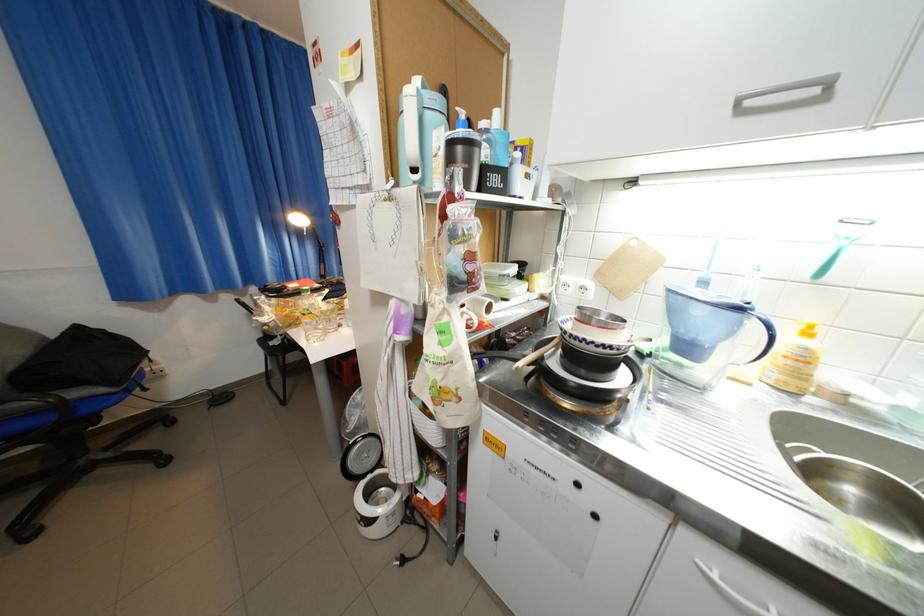
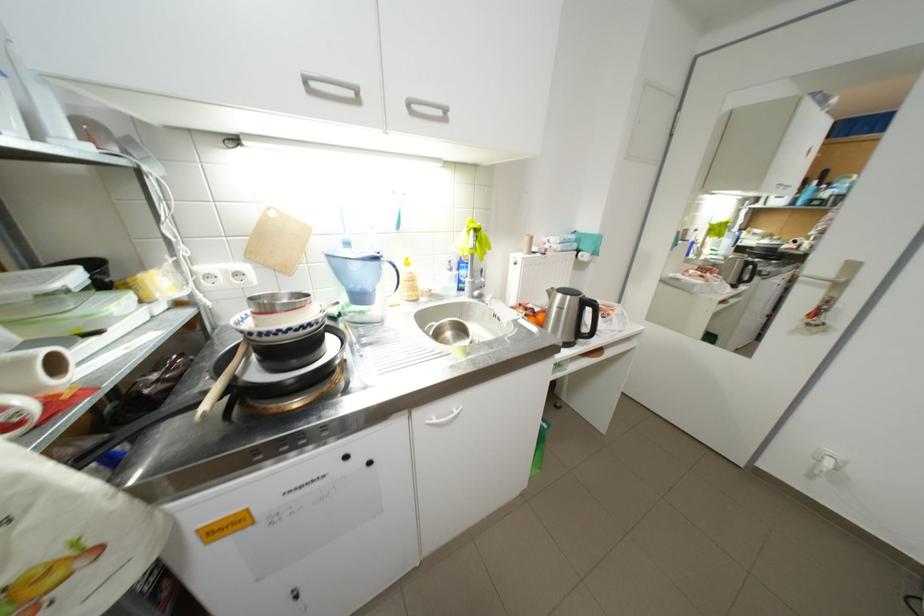
In the second image, find the point that corresponds to [808,461] in the first image.

(443, 334)